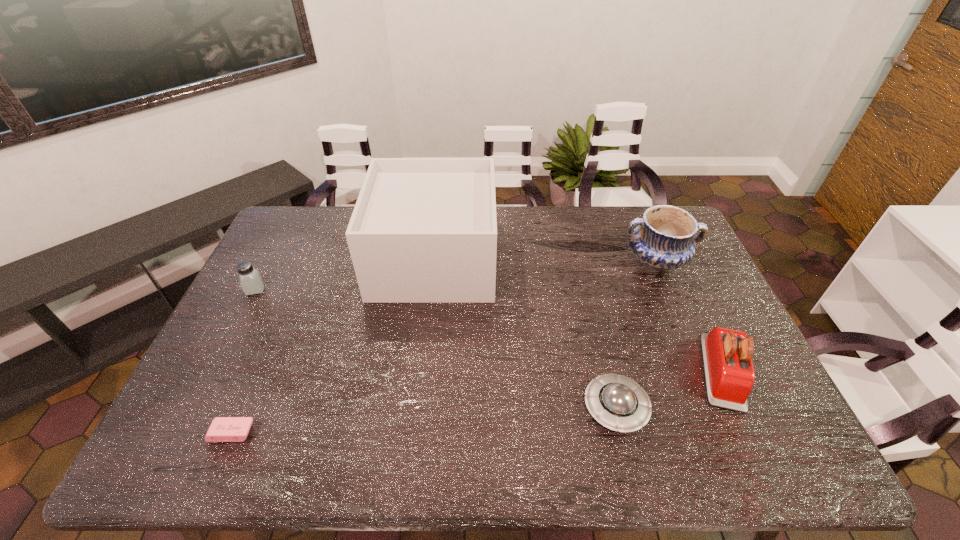
This screenshot has height=540, width=960. In order to click on vacant space located on the side of the tallest object with the window in this screenshot , I will do `click(566, 259)`.

Where is `free region located 0.080m on the front of the fifth shortest object`? The width and height of the screenshot is (960, 540). free region located 0.080m on the front of the fifth shortest object is located at coordinates (673, 300).

You are a GUI agent. You are given a task and a screenshot of the screen. Output one action in this format:
    pyautogui.click(x=<x>, y=<y>)
    Task: Click on the vacant region located on the left of the fourth shortest object
    
    Given the screenshot: What is the action you would take?
    pyautogui.click(x=628, y=372)

You are a GUI agent. You are given a task and a screenshot of the screen. Output one action in this format:
    pyautogui.click(x=<x>, y=<y>)
    Task: Click on the vacant area situated on the front of the third shortest object
    The height and width of the screenshot is (540, 960).
    Given the screenshot: What is the action you would take?
    pyautogui.click(x=194, y=410)

The image size is (960, 540). I want to click on blank area located on the right of the fifth tallest object, so click(x=732, y=407).

Find the location of a particular element. free space located 0.250m on the back of the shortest object is located at coordinates (x=271, y=341).

Identify the location of box that is at the far edge. The image size is (960, 540). (424, 230).

Find the location of a particular element. The image size is (960, 540). pottery present at the far edge is located at coordinates (663, 240).

Where is `saucer located in the near edge section of the desktop`? This screenshot has height=540, width=960. saucer located in the near edge section of the desktop is located at coordinates (617, 402).

Identify the location of eraser at the near edge. The width and height of the screenshot is (960, 540). (222, 429).